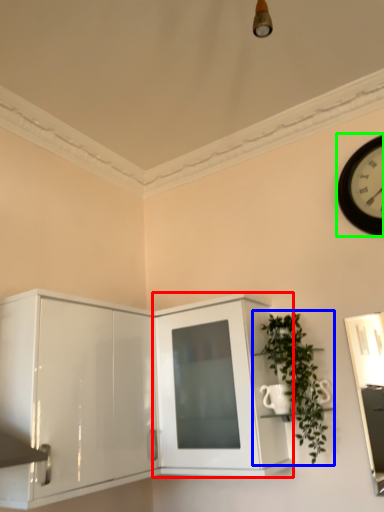
Question: Based on their relative distances, which object is nearer to cabinetry (highlighted by a red box)? Choose from houseplant (highlighted by a blue box) and wall clock (highlighted by a green box).

Choices:
 (A) houseplant
 (B) wall clock

Answer: (A)